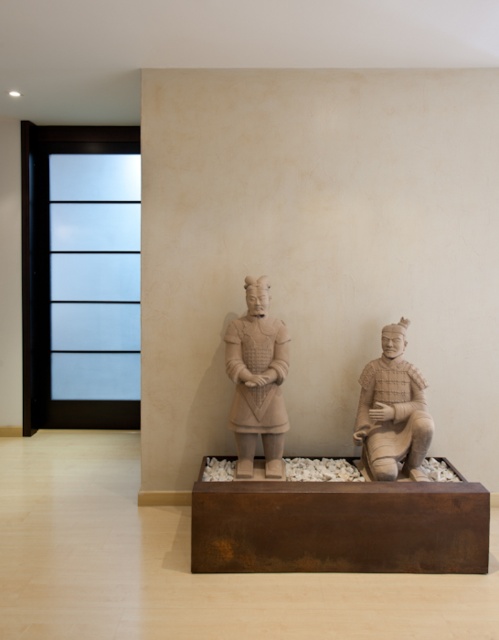
Is matte clay warrior at center to the right of matte clay figure at center from the viewer's perspective?

In fact, matte clay warrior at center is to the left of matte clay figure at center.

Which is above, matte clay warrior at center or matte clay figure at center?

matte clay warrior at center is higher up.

This screenshot has width=499, height=640. I want to click on matte clay warrior at center, so coord(257,380).

What are the coordinates of `matte clay warrior at center` in the screenshot? It's located at (257, 380).